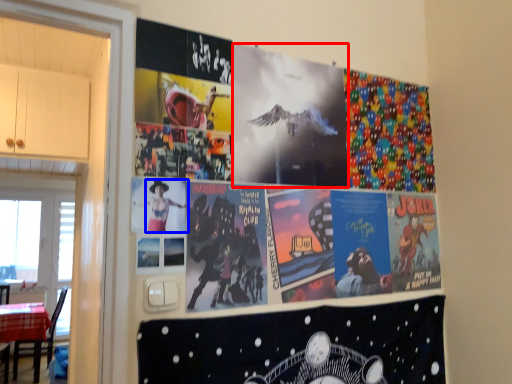
Question: Which point is further to the camera, movie poster (highlighted by a red box) or person (highlighted by a blue box)?

Choices:
 (A) movie poster
 (B) person

Answer: (A)